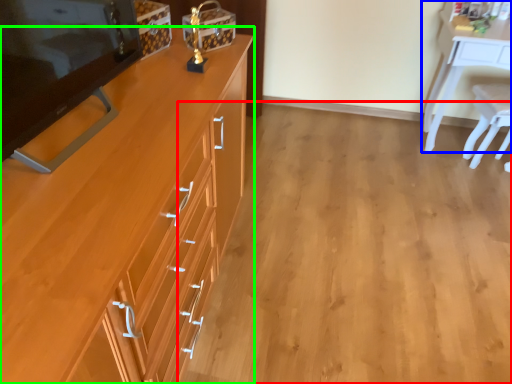
Question: Considering the real-world distances, which object is closest to plain (highlighted by a red box)? desk (highlighted by a blue box) or cabinetry (highlighted by a green box).

Choices:
 (A) desk
 (B) cabinetry

Answer: (B)